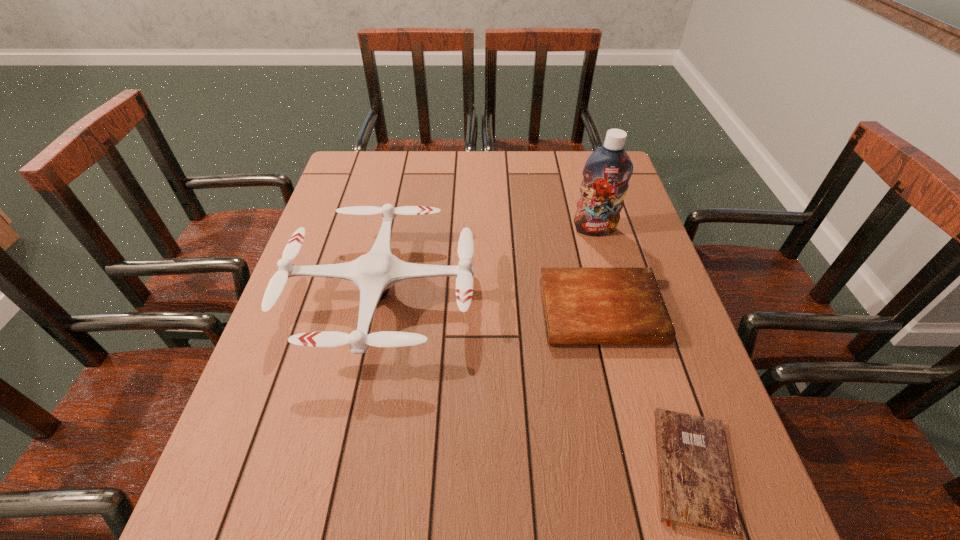
Find the location of a particular element. vacant region located on the back of the nearer Bible is located at coordinates (627, 270).

The image size is (960, 540). I want to click on object that is at the near edge, so click(x=696, y=490).

You are a GUI agent. You are given a task and a screenshot of the screen. Output one action in this format:
    pyautogui.click(x=<x>, y=<y>)
    Task: Click on the object that is at the left edge
    
    Given the screenshot: What is the action you would take?
    pyautogui.click(x=374, y=273)

The image size is (960, 540). Find the location of `shampoo present at the right edge`. shampoo present at the right edge is located at coordinates (607, 171).

Where is `object at the near right corner`? object at the near right corner is located at coordinates (696, 490).

The width and height of the screenshot is (960, 540). What are the coordinates of `vacant space at the far edge of the desktop` in the screenshot? It's located at (450, 157).

This screenshot has height=540, width=960. What are the coordinates of `blank area at the left edge` in the screenshot? It's located at (x=316, y=411).

The height and width of the screenshot is (540, 960). Identify the location of free space at the right edge of the desktop. (658, 280).

The image size is (960, 540). I want to click on vacant space at the far left corner, so click(393, 156).

The width and height of the screenshot is (960, 540). I want to click on vacant space that's between the shorter Bible and the shampoo, so click(x=643, y=349).